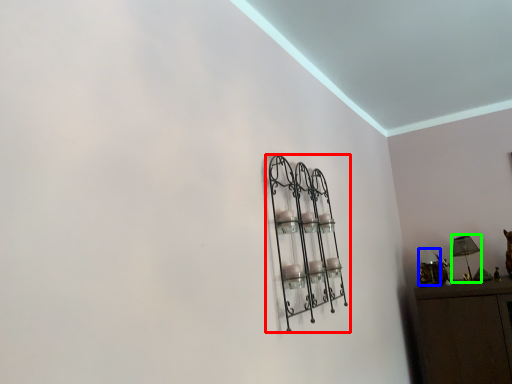
Question: Based on their relative distances, which object is nearer to shelf (highlighted by a red box)? Choose from lamp (highlighted by a blue box) and table lamp (highlighted by a green box).

Choices:
 (A) lamp
 (B) table lamp

Answer: (A)